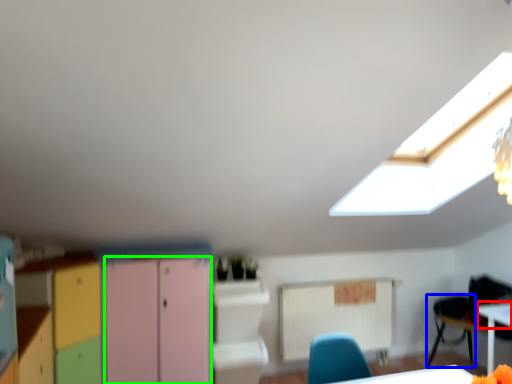
Question: Which is nearer to the table top (highlighted by a red box)? armchair (highlighted by a blue box) or file cabinet (highlighted by a green box).

Choices:
 (A) armchair
 (B) file cabinet

Answer: (A)